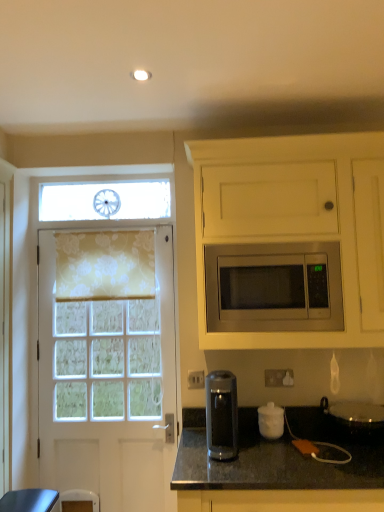
This screenshot has width=384, height=512. I want to click on white plastic electric outlet at lower center, so click(279, 377).

Measure the distance between white plastic electric outlet at lower center and camera.

white plastic electric outlet at lower center and camera are 2.20 meters apart.

Locate an element on the screen. This screenshot has width=384, height=512. metallic silver pot at lower right, which is the 1th appliance in right-to-left order is located at coordinates (355, 418).

What do you see at coordinates (277, 455) in the screenshot?
I see `black granite countertop at lower center` at bounding box center [277, 455].

Identify the location of white plastic electric outlet at lower center. (279, 377).

Consider the image. What's the angular difference between floral fabric curtain at left and white floral fabric at left's facing directions?

1.07 degrees separate the facing orientations of floral fabric curtain at left and white floral fabric at left.

In the scene shown: Is floral fabric curtain at left behind white floral fabric at left?

Result: Yes, it is behind white floral fabric at left.

Which is more to the right, floral fabric curtain at left or white floral fabric at left?

Positioned to the right is white floral fabric at left.

What are the coordinates of `curtain on the left of white floral fabric at left` in the screenshot? It's located at (105, 265).

Is white matte jar at lower center, which is counted as the 1th appliance, starting from the left, located within stainless steel microwave at center?

No, white matte jar at lower center, which is counted as the 1th appliance, starting from the left, is not a part of stainless steel microwave at center.

Looking at this image, from a real-world perspective, is stainless steel microwave at center on top of white matte jar at lower center, which is counted as the 1th appliance, starting from the left?

Indeed, from a real-world perspective, stainless steel microwave at center stands above white matte jar at lower center, which is counted as the 1th appliance, starting from the left.

Looking at this image, which object is closer to the camera, stainless steel microwave at center or white matte jar at lower center, which is counted as the 1th appliance, starting from the left?

stainless steel microwave at center is more forward.

From a real-world perspective, between stainless steel microwave at center and floral fabric curtain at left, who is vertically higher?

From a 3D spatial view, floral fabric curtain at left is above.

Which of these two, stainless steel microwave at center or floral fabric curtain at left, stands shorter?

Standing shorter between the two is stainless steel microwave at center.

Considering the sizes of stainless steel microwave at center and floral fabric curtain at left in the image, is stainless steel microwave at center bigger or smaller than floral fabric curtain at left?

stainless steel microwave at center is bigger than floral fabric curtain at left.

Is point (257, 290) more distant than point (87, 257)?

No, it is in front of (87, 257).

Which of these two, metallic silver pot at lower right, the 2th appliance positioned from the left, or white plastic electric outlet at lower center, is bigger?

metallic silver pot at lower right, the 2th appliance positioned from the left, is bigger.

Between metallic silver pot at lower right, which is the 1th appliance in right-to-left order, and white plastic electric outlet at lower center, which one has smaller width?

white plastic electric outlet at lower center is thinner.

From a real-world perspective, is metallic silver pot at lower right, which is the 1th appliance in right-to-left order, positioned above or below white plastic electric outlet at lower center?

Clearly, from a real-world perspective, metallic silver pot at lower right, which is the 1th appliance in right-to-left order, is below white plastic electric outlet at lower center.

Which point is more distant from viewer, (x=383, y=428) or (x=292, y=375)?

The point (x=292, y=375) is behind.

How far apart are black granite countertop at lower center and floral fabric curtain at left?

black granite countertop at lower center is 38.94 inches from floral fabric curtain at left.

Is black granite countertop at lower center directly adjacent to floral fabric curtain at left?

No, black granite countertop at lower center is not beside floral fabric curtain at left.

Is floral fabric curtain at left located within black granite countertop at lower center?

Actually, floral fabric curtain at left is outside black granite countertop at lower center.

From the image's perspective, between black granite countertop at lower center and floral fabric curtain at left, which one is located above?

floral fabric curtain at left, from the image's perspective.

Can you tell me how much stainless steel microwave at center and white matte cabinet at upper right differ in facing direction?

They differ by 0.4 degrees in their facing directions.

Is stainless steel microwave at center oriented away from white matte cabinet at upper right?

Yes, white matte cabinet at upper right is at the back of stainless steel microwave at center.

From the image's perspective, would you say stainless steel microwave at center is positioned over white matte cabinet at upper right?

No, from the image's perspective, stainless steel microwave at center is not above white matte cabinet at upper right.

Consider the image. Between stainless steel microwave at center and white matte cabinet at upper right, which one has less height?

With less height is stainless steel microwave at center.

From the image's perspective, which one is positioned lower, white floral fabric at left or stainless steel microwave at center?

white floral fabric at left, from the image's perspective.

Is stainless steel microwave at center surrounded by white floral fabric at left?

No, stainless steel microwave at center is not surrounded by white floral fabric at left.

Are white floral fabric at left and stainless steel microwave at center making contact?

white floral fabric at left is not next to stainless steel microwave at center, and they're not touching.

Which is behind, white floral fabric at left or stainless steel microwave at center?

white floral fabric at left is further from the camera.

The width and height of the screenshot is (384, 512). I want to click on curtain above the white floral fabric at left (from the image's perspective), so click(x=105, y=265).

Where is `appliance behind the stainless steel microwave at center`? appliance behind the stainless steel microwave at center is located at coordinates (271, 421).

Which object lies nearer to the anchor point white floral fabric at left, white matte jar at lower center, the 2th appliance from the right, or white matte cabinet at upper right?

white matte jar at lower center, the 2th appliance from the right, is closer to white floral fabric at left.

Which object lies nearer to the anchor point white matte jar at lower center, the 2th appliance from the right, white floral fabric at left or metallic silver pot at lower right, the 2th appliance positioned from the left?

metallic silver pot at lower right, the 2th appliance positioned from the left, is positioned closer to the anchor white matte jar at lower center, the 2th appliance from the right.

Based on their spatial positions, is black granite countertop at lower center or white matte cabinet at upper right closer to white plastic electric outlet at lower center?

black granite countertop at lower center lies closer to white plastic electric outlet at lower center than the other object.

Estimate the real-world distances between objects in this image. Which object is closer to stainless steel microwave at center, white matte cabinet at upper right or floral fabric curtain at left?

Based on the image, white matte cabinet at upper right appears to be nearer to stainless steel microwave at center.

When comparing their distances from black granite countertop at lower center, does white matte jar at lower center, which is counted as the 1th appliance, starting from the left, or white floral fabric at left seem closer?

white matte jar at lower center, which is counted as the 1th appliance, starting from the left, lies closer to black granite countertop at lower center than the other object.

Which object lies nearer to the anchor point white matte jar at lower center, the 2th appliance from the right, white matte cabinet at upper right or transparent plastic coffee machine at lower center?

transparent plastic coffee machine at lower center is positioned closer to the anchor white matte jar at lower center, the 2th appliance from the right.

Looking at the image, which one is located closer to metallic silver pot at lower right, the 2th appliance positioned from the left, white plastic electric outlet at lower center or white matte cabinet at upper right?

Based on the image, white plastic electric outlet at lower center appears to be nearer to metallic silver pot at lower right, the 2th appliance positioned from the left.

Estimate the real-world distances between objects in this image. Which object is closer to stainless steel microwave at center, transparent plastic coffee machine at lower center or metallic silver pot at lower right, the 2th appliance positioned from the left?

transparent plastic coffee machine at lower center lies closer to stainless steel microwave at center than the other object.

Where is `appliance between floral fabric curtain at left and metallic silver pot at lower right, the 2th appliance positioned from the left, from left to right`? This screenshot has height=512, width=384. appliance between floral fabric curtain at left and metallic silver pot at lower right, the 2th appliance positioned from the left, from left to right is located at coordinates (271, 421).

Identify the location of coffee machine situated between floral fabric curtain at left and white matte cabinet at upper right from left to right. The width and height of the screenshot is (384, 512). click(221, 415).

The height and width of the screenshot is (512, 384). In order to click on door between floral fabric curtain at left and metallic silver pot at lower right, which is the 1th appliance in right-to-left order, from left to right in this screenshot , I will do pyautogui.click(x=108, y=388).

At what (x,y) coordinates should I click in order to perform the action: click on coffee machine located between floral fabric curtain at left and white plastic electric outlet at lower center in the left-right direction. Please return your answer as a coordinate pair (x, y). Looking at the image, I should click on (221, 415).